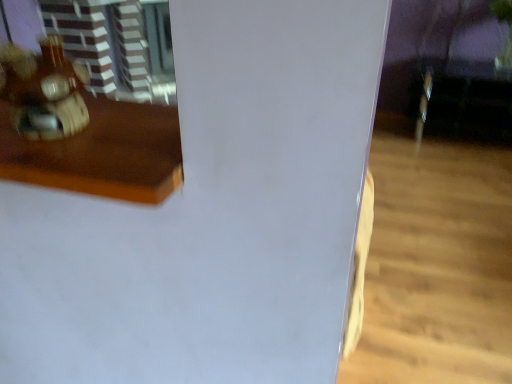
Locate an element on the screen. spots to the right of wooden toy at left is located at coordinates (130, 136).